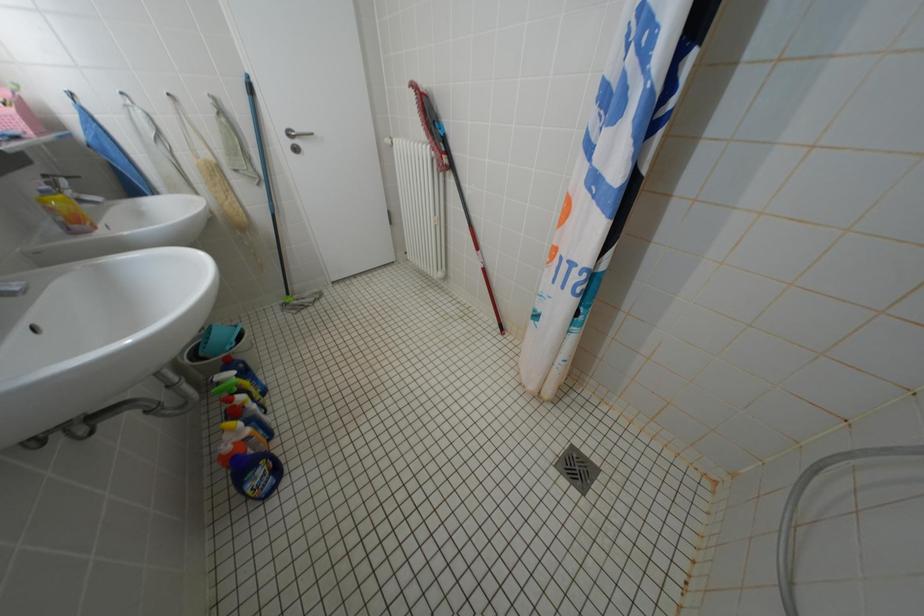
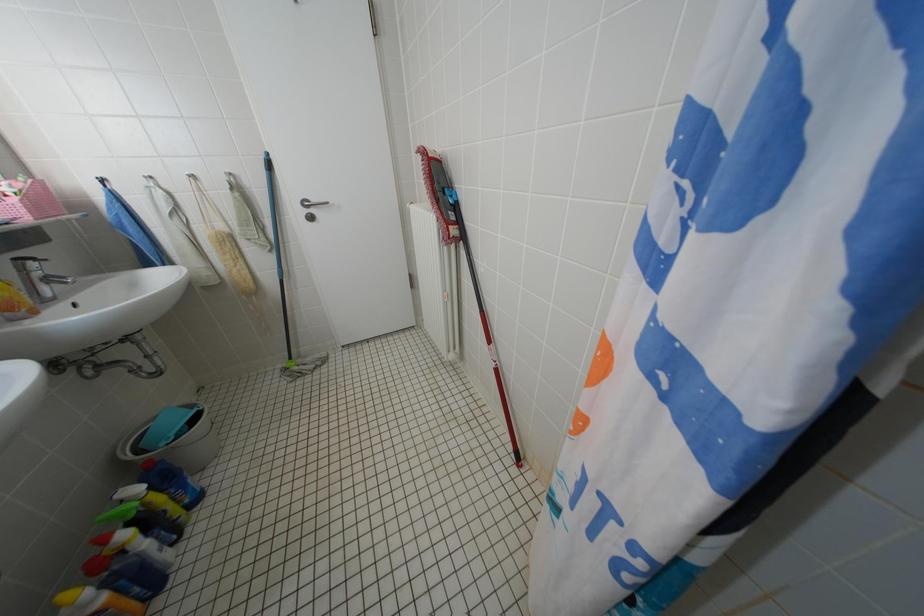
Question: The camera is either moving clockwise (left) or counter-clockwise (right) around the object. The first image is from the beginning of the video and the second image is from the end. Is the camera moving left or right when shooting the video?

Choices:
 (A) Left
 (B) Right

Answer: (B)